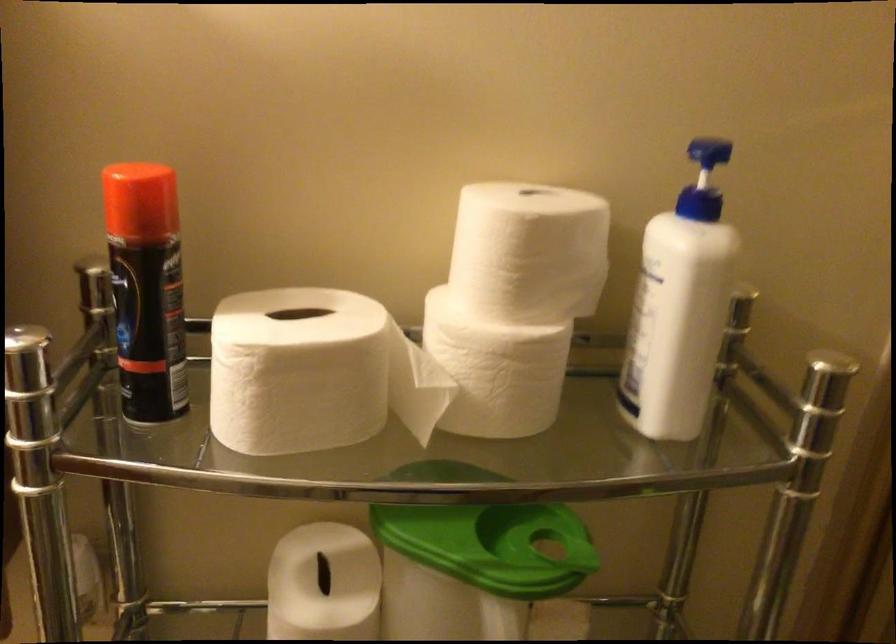
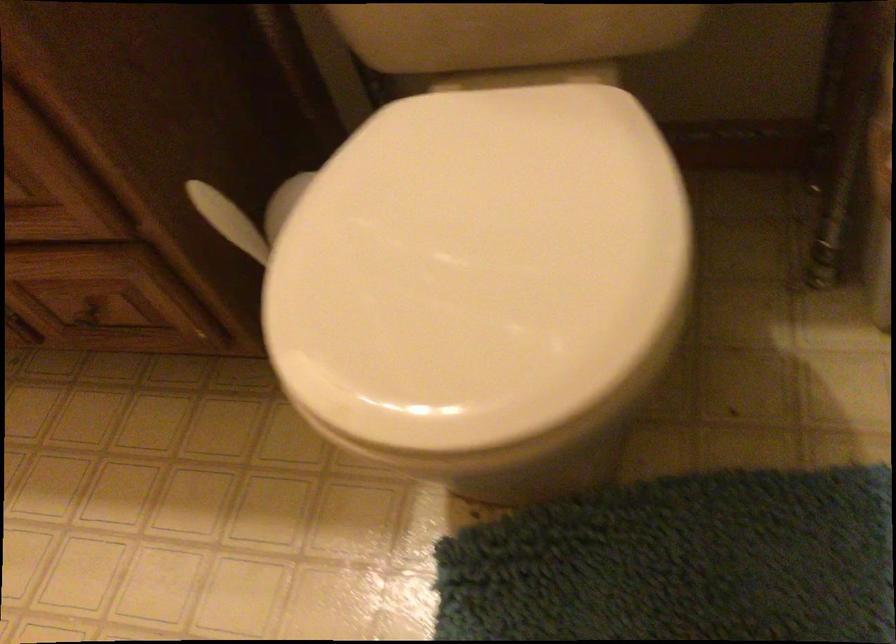
How did the camera likely rotate?

The camera rotated toward left-down.